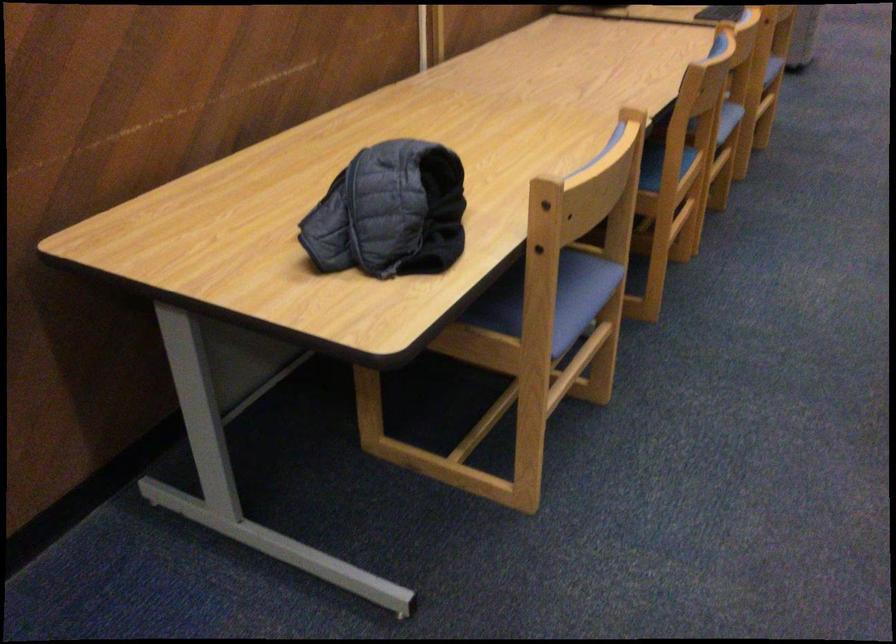
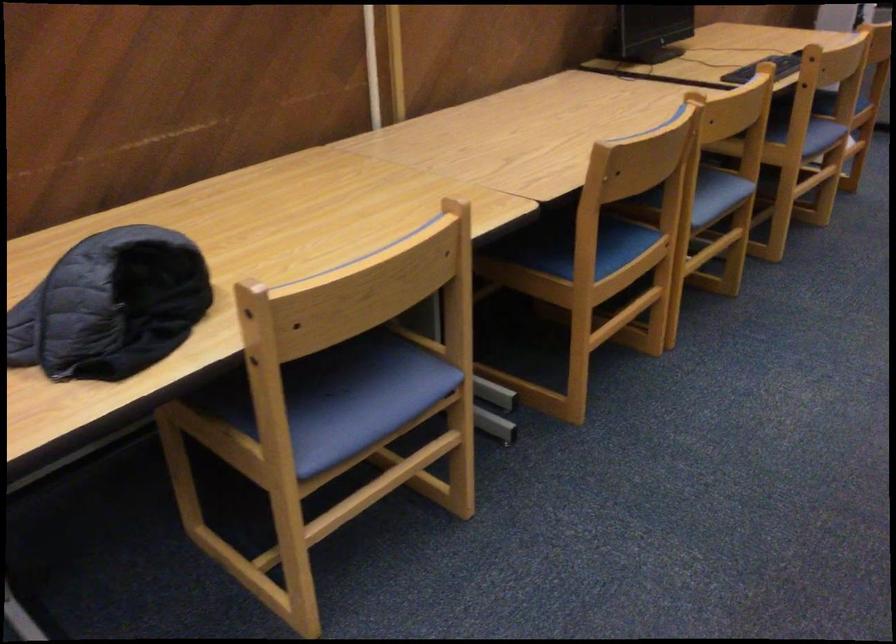
The point at (x=767, y=71) is marked in the first image. Where is the corresponding point in the second image?

(821, 136)